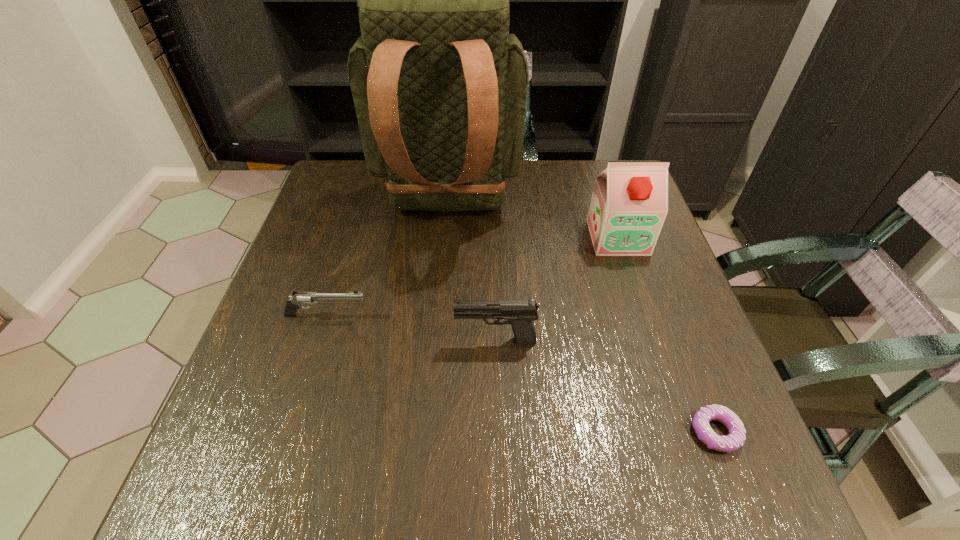
Locate an element on the screen. The height and width of the screenshot is (540, 960). backpack is located at coordinates (439, 85).

Find the location of a particular element. soya milk is located at coordinates (629, 204).

Where is `the fourth farthest object`? the fourth farthest object is located at coordinates (520, 314).

Find the location of a particular element. The width and height of the screenshot is (960, 540). the right pistol is located at coordinates (520, 314).

The image size is (960, 540). Identify the location of the farther pistol. (299, 298).

This screenshot has width=960, height=540. Identify the location of the shorter pistol. (299, 298).

You are a GUI agent. You are given a task and a screenshot of the screen. Output one action in this format:
    pyautogui.click(x=<x>, y=<y>)
    Task: Click on the doughnut
    This screenshot has width=960, height=540.
    Given the screenshot: What is the action you would take?
    pyautogui.click(x=736, y=438)

Locate an element on the screen. the shortest object is located at coordinates (736, 438).

The width and height of the screenshot is (960, 540). In order to click on vacant space located on the back of the tallest object in this screenshot , I will do `click(443, 274)`.

Where is `vacant space located with the cap open on the soya milk`? The image size is (960, 540). vacant space located with the cap open on the soya milk is located at coordinates (671, 399).